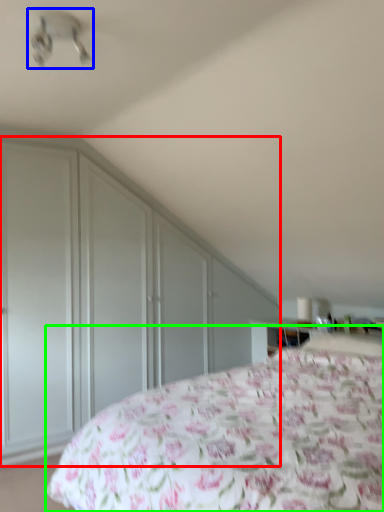
Question: Which object is positioned farthest from dresser (highlighted by a red box)? Select from fan (highlighted by a blue box) and bed (highlighted by a green box).

Choices:
 (A) fan
 (B) bed

Answer: (A)